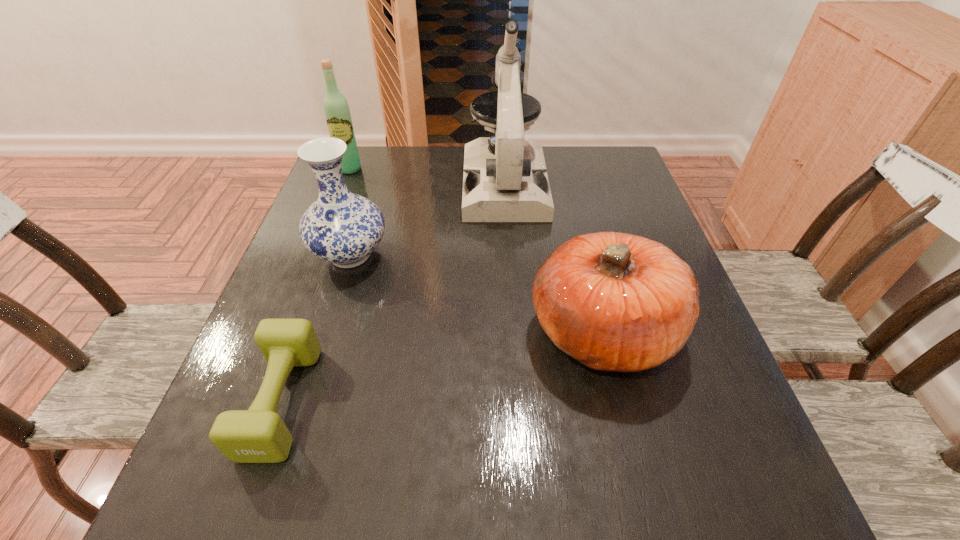
This screenshot has width=960, height=540. In the image, there is a desktop. Identify the location of free space at the right edge. (588, 211).

Locate an element on the screen. This screenshot has width=960, height=540. free point at the far right corner is located at coordinates (624, 173).

The height and width of the screenshot is (540, 960). I want to click on vacant region between the pumpkin and the shortest object, so click(443, 366).

This screenshot has height=540, width=960. I want to click on free space between the microscope and the vase, so click(x=427, y=220).

The height and width of the screenshot is (540, 960). What are the coordinates of `free point between the shortest object and the pumpkin` in the screenshot? It's located at (443, 366).

Identify the location of empty location between the vase and the tallest object. (427, 220).

You are a GUI agent. You are given a task and a screenshot of the screen. Output one action in this format:
    pyautogui.click(x=<x>, y=<y>)
    Task: Click on the empty space that is in between the second shortest object and the wine bottle
    
    Given the screenshot: What is the action you would take?
    pyautogui.click(x=476, y=251)

Where is `free space between the pumpkin and the dumbbell`? The height and width of the screenshot is (540, 960). free space between the pumpkin and the dumbbell is located at coordinates (443, 366).

Identify the location of vacant area that lies between the tallest object and the shortest object. (393, 293).

At what (x,y) coordinates should I click in order to perform the action: click on vacant space that's between the fourth tallest object and the vase. Please return your answer as a coordinate pair (x, y). Looking at the image, I should click on (476, 293).